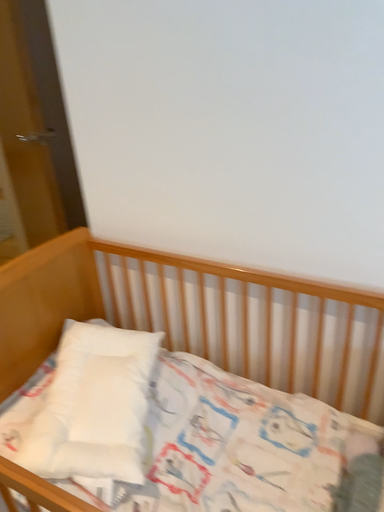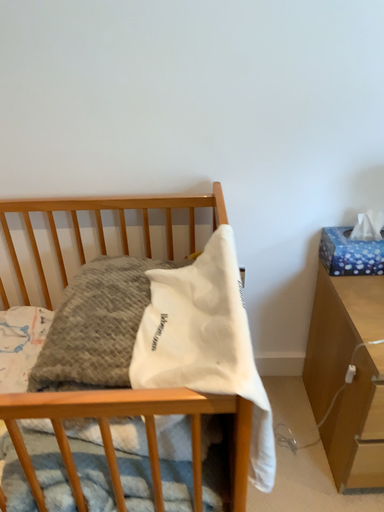
Question: Which way did the camera rotate in the video?

Choices:
 (A) rotated right
 (B) rotated left

Answer: (A)